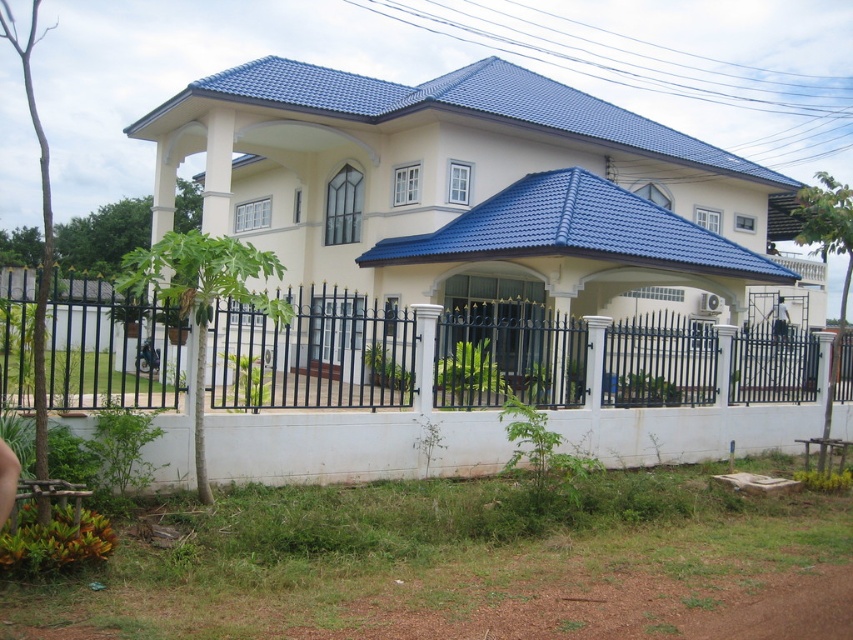
You are standing at the entrance of the house and want to know the exact location of the black metal fence at lower center. Can you determine its coordinates based on the image?

The black metal fence at lower center is located at coordinates point (312, 355).

You are standing at the entrance of the house and want to check if you can reach the black metal fence at lower center without moving closer than 6 meters. Can you reach it?

The black metal fence at lower center is 6.57 meters away from the camera, so you cannot reach it without moving closer than 6 meters since it is further away.